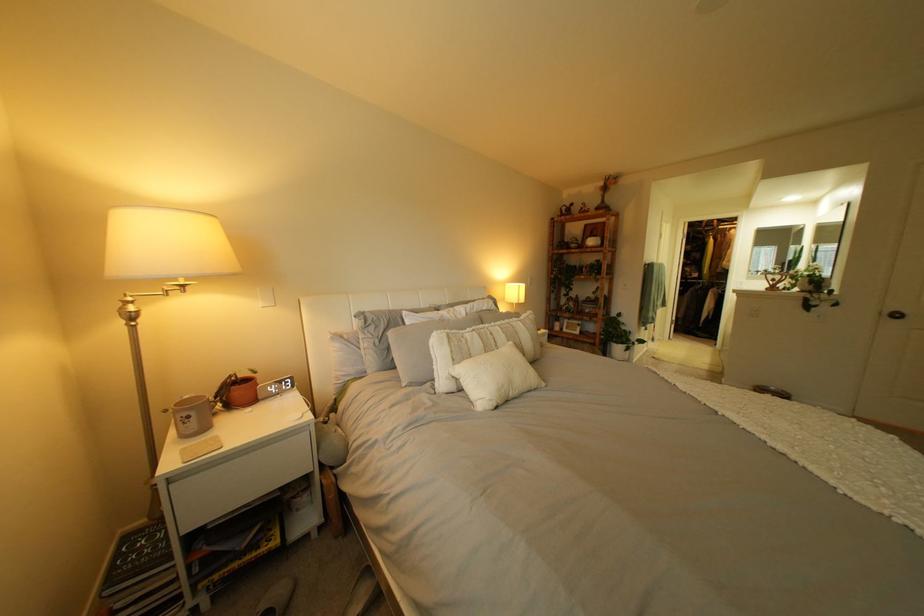
The height and width of the screenshot is (616, 924). I want to click on grey mug handle, so click(190, 416).